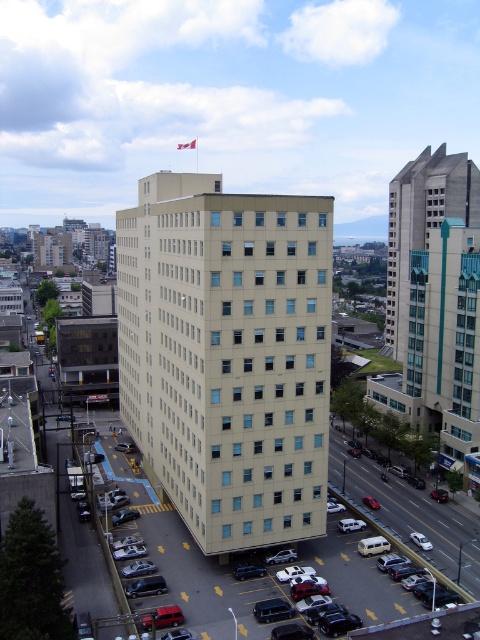
Question: Which point is closer to the camera taking this photo?

Choices:
 (A) (468, 525)
 (B) (195, 140)

Answer: (A)

Question: Can you confirm if black asphalt parking lot at lower center is thinner than red fabric flag at upper center?

Choices:
 (A) no
 (B) yes

Answer: (A)

Question: Which object appears farthest from the camera in this image?

Choices:
 (A) red fabric flag at upper center
 (B) black asphalt parking lot at lower center

Answer: (A)

Question: Is black asphalt parking lot at lower center bigger than red fabric flag at upper center?

Choices:
 (A) yes
 (B) no

Answer: (A)

Question: Does black asphalt parking lot at lower center appear over red fabric flag at upper center?

Choices:
 (A) no
 (B) yes

Answer: (A)

Question: Which point is closer to the camera?

Choices:
 (A) black asphalt parking lot at lower center
 (B) red fabric flag at upper center

Answer: (A)